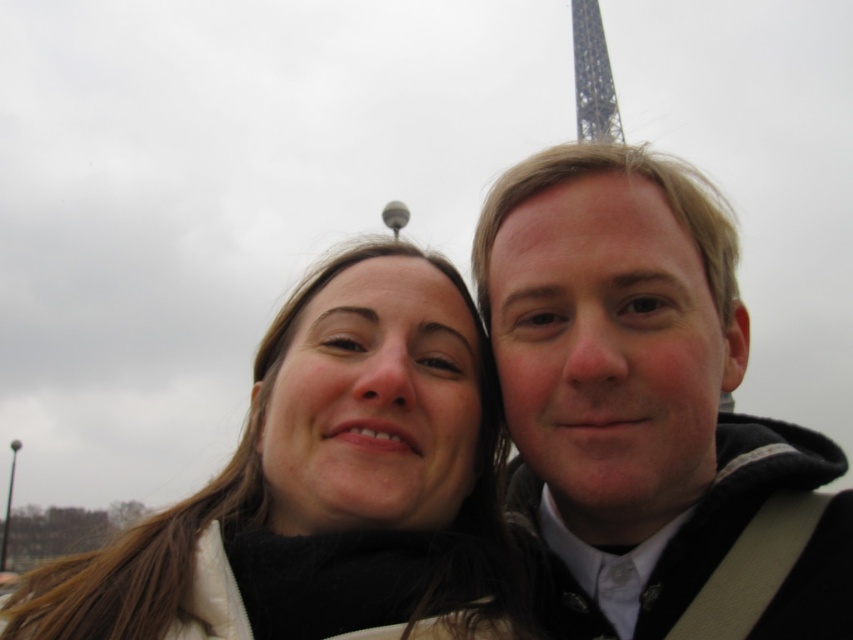
Question: Is smooth black jacket at right positioned behind metallic lattice structure at upper center?

Choices:
 (A) no
 (B) yes

Answer: (A)

Question: Which object appears closest to the camera in this image?

Choices:
 (A) smooth black jacket at right
 (B) matte black jacket at center

Answer: (B)

Question: Which object is the farthest from the matte black jacket at center?

Choices:
 (A) metallic lattice structure at upper center
 (B) smooth black jacket at right

Answer: (A)

Question: In this image, where is matte black jacket at center located relative to metallic lattice structure at upper center?

Choices:
 (A) below
 (B) above

Answer: (A)

Question: Which of the following is the farthest from the observer?

Choices:
 (A) (534, 353)
 (B) (593, 3)
 (C) (503, 605)

Answer: (B)

Question: Is smooth black jacket at right positioned before metallic lattice structure at upper center?

Choices:
 (A) no
 (B) yes

Answer: (B)